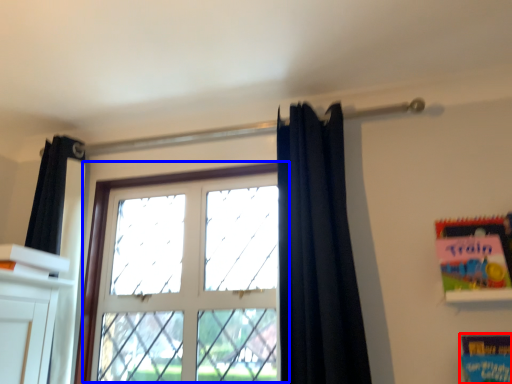
Question: Among these objects, which one is farthest to the camera, paperback book (highlighted by a red box) or window (highlighted by a blue box)?

Choices:
 (A) paperback book
 (B) window

Answer: (B)